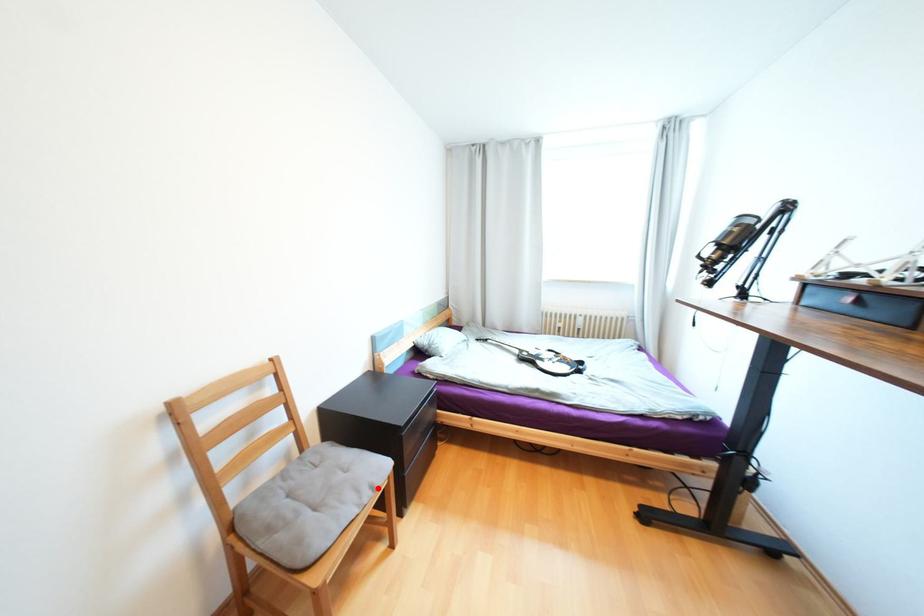
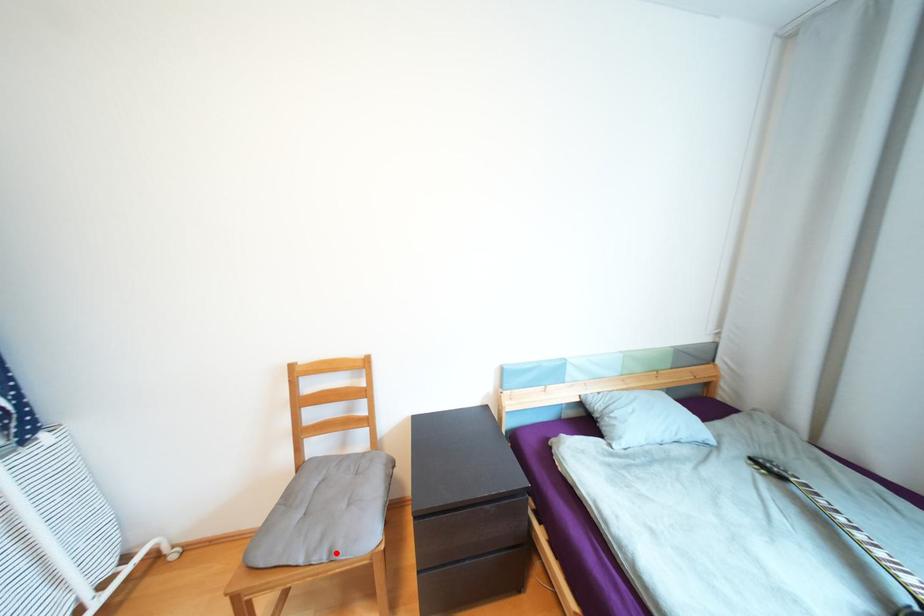
I am providing you with two images of the same scene from different viewpoints. A red point is marked on the first image and another point is marked on the second image. Is the marked point in image1 the same physical position as the marked point in image2?

Yes